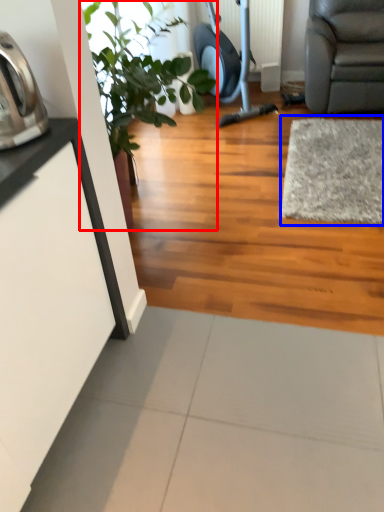
Question: Which point is closer to the camera, houseplant (highlighted by a red box) or mat (highlighted by a blue box)?

Choices:
 (A) houseplant
 (B) mat

Answer: (A)